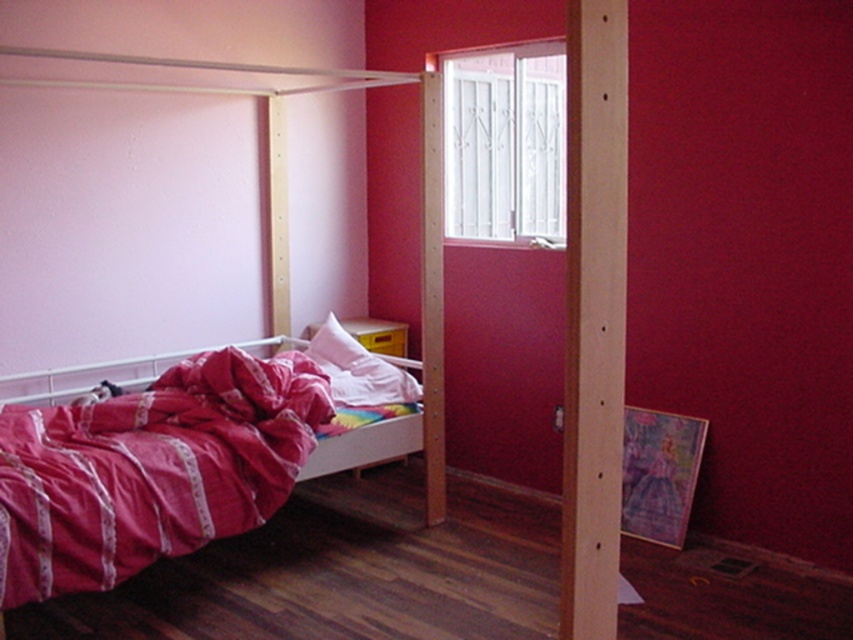
Consider the image. You are standing in the center of the bedroom. The pink fabric bed at left is at point 0.312, 0.338. If you want to walk to the bed, which direction should you move?

Since the pink fabric bed at left is located at coordinates (287, 198), you should move towards the left to reach it.